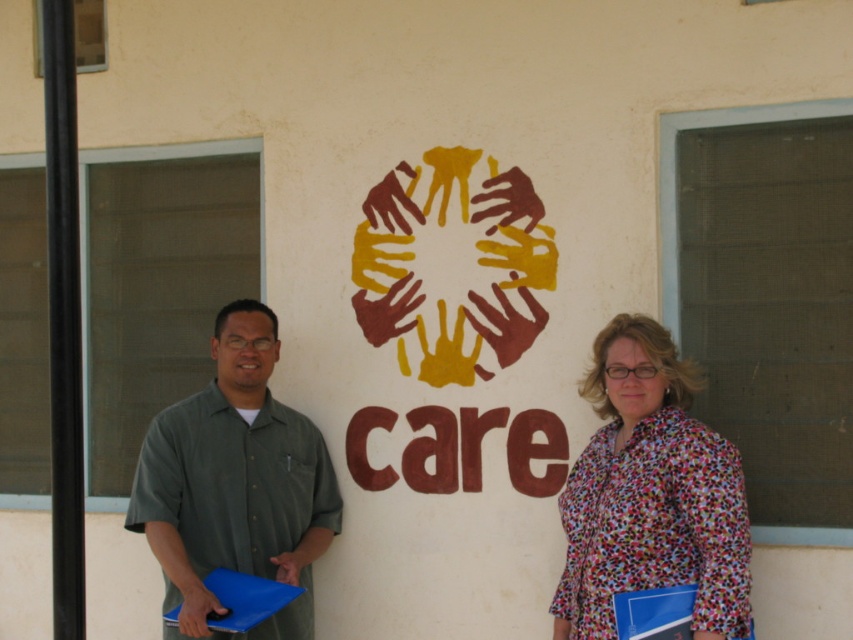
Where is the printed fabric blouse at center located in the image?

The printed fabric blouse at center is located at point (x=650, y=493) in the image.

Based on the photo, you are an observer looking at the two green items on the left side of the image. Which one is narrower? Please choose between the green shirt at left and the green fabric shirt at left.

The green shirt at left is narrower than the green fabric shirt at left.